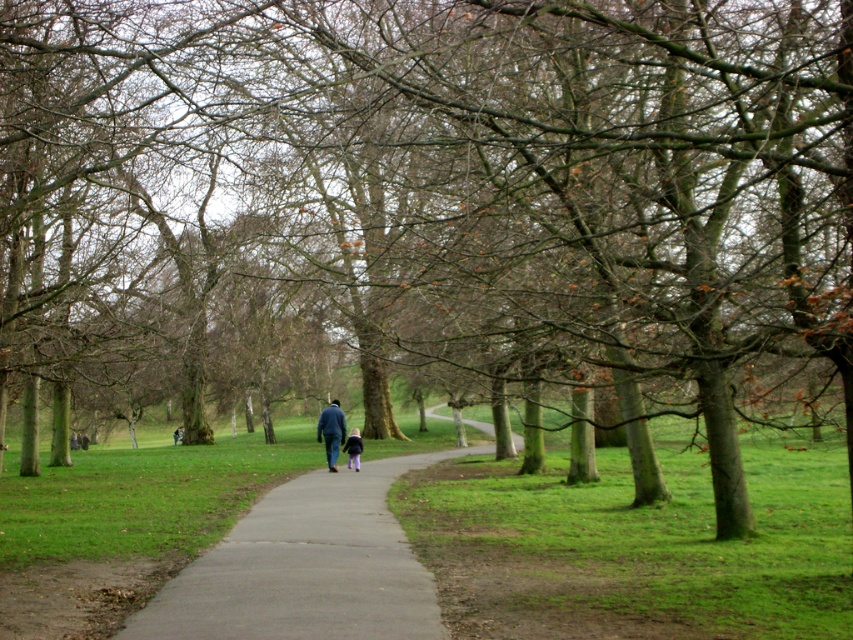
Question: Which object appears closest to the camera in this image?

Choices:
 (A) dark blue jacket at center
 (B) gray concrete pavement at center

Answer: (B)

Question: Does dark blue jeans at center have a larger size compared to dark blue jacket at center?

Choices:
 (A) yes
 (B) no

Answer: (B)

Question: Is blue fabric jacket at center wider than dark blue jacket at center?

Choices:
 (A) no
 (B) yes

Answer: (B)

Question: Which point is closer to the camera?

Choices:
 (A) (337, 406)
 (B) (352, 452)

Answer: (A)

Question: Does dark blue jeans at center appear on the left side of dark blue jacket at center?

Choices:
 (A) no
 (B) yes

Answer: (A)

Question: Which object appears farthest from the camera in this image?

Choices:
 (A) dark blue jacket at center
 (B) dark blue jeans at center

Answer: (A)